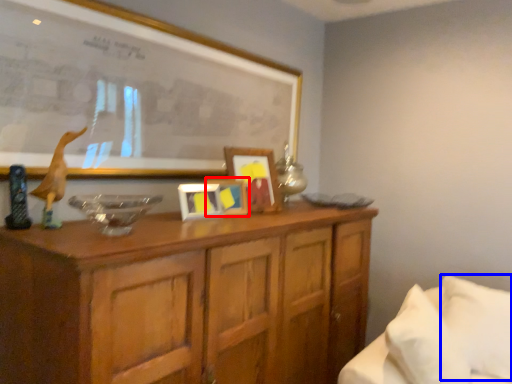
Question: Which object is further to the camera taking this photo, picture frame (highlighted by a red box) or pillow (highlighted by a blue box)?

Choices:
 (A) picture frame
 (B) pillow

Answer: (A)